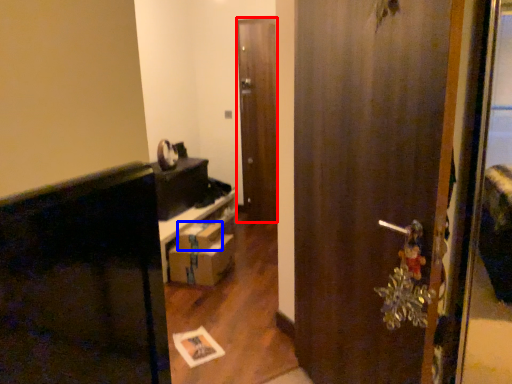
Question: Among these objects, which one is nearest to the camera, door (highlighted by a red box) or box (highlighted by a blue box)?

Choices:
 (A) door
 (B) box

Answer: (B)